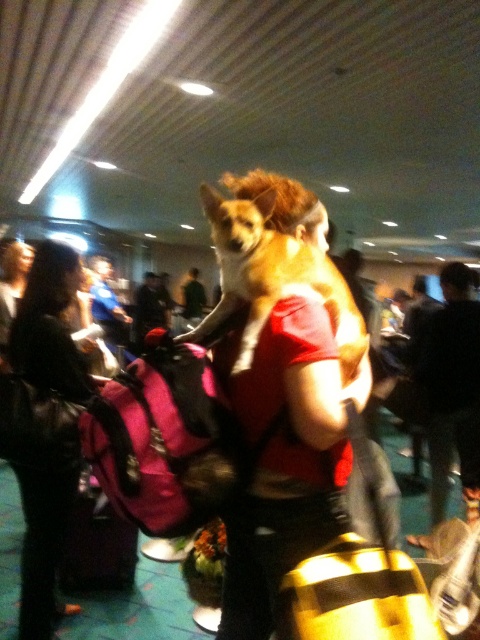
Is black leather jacket at left closer to the viewer compared to brown furry dog at center?

No, black leather jacket at left is behind brown furry dog at center.

At what (x,y) coordinates should I click in order to perform the action: click on black leather jacket at left. Please return your answer as a coordinate pair (x, y). Image resolution: width=480 pixels, height=640 pixels. Looking at the image, I should click on (44, 520).

The width and height of the screenshot is (480, 640). What do you see at coordinates (44, 520) in the screenshot?
I see `black leather jacket at left` at bounding box center [44, 520].

You are a GUI agent. You are given a task and a screenshot of the screen. Output one action in this format:
    pyautogui.click(x=<x>, y=<y>)
    Task: Click on the black leather jacket at left
    This screenshot has height=640, width=480.
    Given the screenshot: What is the action you would take?
    pyautogui.click(x=44, y=520)